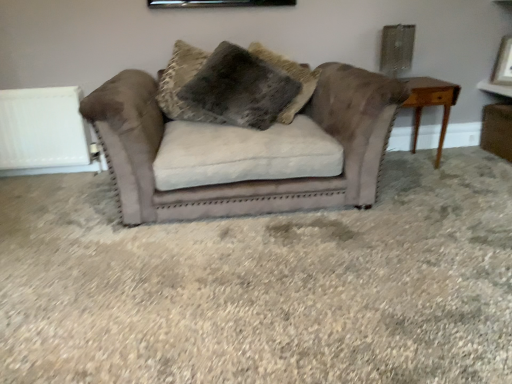
The image size is (512, 384). I want to click on vacant point above white matte radiator at left (from a real-world perspective), so click(x=28, y=92).